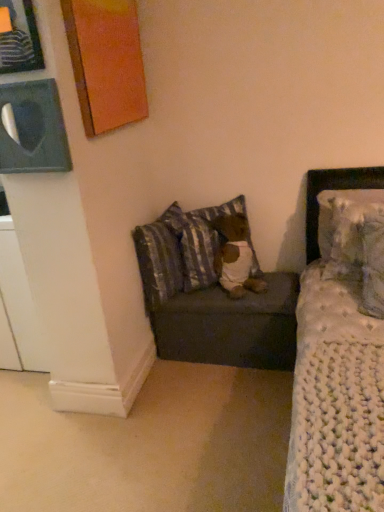
You are a GUI agent. You are given a task and a screenshot of the screen. Output one action in this format:
    pyautogui.click(x=<x>, y=<y>)
    Task: Click on the striped fabric pillow at lower center, the 2th pillow positioned from the left
    The width and height of the screenshot is (384, 512).
    Given the screenshot: What is the action you would take?
    pyautogui.click(x=180, y=251)

Where is `matte black picture frame at upper left, which is the third picture frame from back to front`? The width and height of the screenshot is (384, 512). matte black picture frame at upper left, which is the third picture frame from back to front is located at coordinates (19, 38).

Is striped fabric pillow at lower center, the 2th pillow positioned from the left, further to the viewer compared to dark gray fabric ottoman at center?

Yes, striped fabric pillow at lower center, the 2th pillow positioned from the left, is behind dark gray fabric ottoman at center.

Is striped fabric pillow at lower center, which ranks as the third pillow in right-to-left order, placed right next to dark gray fabric ottoman at center?

striped fabric pillow at lower center, which ranks as the third pillow in right-to-left order, and dark gray fabric ottoman at center are not in contact.

The height and width of the screenshot is (512, 384). I want to click on pillow located behind the dark gray fabric ottoman at center, so click(180, 251).

From the image's perspective, which one is positioned lower, striped fabric pillow at lower center, which ranks as the third pillow in right-to-left order, or dark gray fabric ottoman at center?

dark gray fabric ottoman at center is shown below in the image.

From the image's perspective, relative to white knitted pillow at upper right, placed as the second pillow when sorted from right to left, is white fluffy pillow at upper right, acting as the fourth pillow starting from the left, above or below?

From the image's perspective, white fluffy pillow at upper right, acting as the fourth pillow starting from the left, appears above white knitted pillow at upper right, placed as the second pillow when sorted from right to left.

Can you confirm if white fluffy pillow at upper right, acting as the fourth pillow starting from the left, is wider than white knitted pillow at upper right, placed as the second pillow when sorted from right to left?

In fact, white fluffy pillow at upper right, acting as the fourth pillow starting from the left, might be narrower than white knitted pillow at upper right, placed as the second pillow when sorted from right to left.

Which of these two, striped fabric pillow at lower left, which is counted as the first pillow, starting from the left, or brown plush bear at center, is wider?

With larger width is brown plush bear at center.

Could you tell me if striped fabric pillow at lower left, the fourth pillow from the right, is turned towards brown plush bear at center?

Yes, striped fabric pillow at lower left, the fourth pillow from the right, faces towards brown plush bear at center.

Does point (158, 288) appear closer or farther from the camera than point (243, 236)?

Point (158, 288).

Is striped fabric pillow at lower left, which is counted as the first pillow, starting from the left, not close to matte black picture frame at upper left, which is the first picture frame from back to front?

No, striped fabric pillow at lower left, which is counted as the first pillow, starting from the left, is in close proximity to matte black picture frame at upper left, which is the first picture frame from back to front.

Considering the positions of points (158, 283) and (17, 83), is point (158, 283) closer to camera compared to point (17, 83)?

No.

Which of these two, striped fabric pillow at lower left, the fourth pillow from the right, or matte black picture frame at upper left, which is the first picture frame from back to front, is bigger?

Bigger between the two is striped fabric pillow at lower left, the fourth pillow from the right.

From a real-world perspective, which is physically above, striped fabric pillow at lower left, the fourth pillow from the right, or matte black picture frame at upper left, which is the first picture frame from back to front?

In real-world perspective, matte black picture frame at upper left, which is the first picture frame from back to front, is above.

Which is in front, point (85, 77) or point (154, 275)?

The point (85, 77) is more forward.

Is orange painted wood picture frame at upper left, positioned as the second picture frame in back-to-front order, turned away from striped fabric pillow at lower center, the 2th pillow positioned from the left?

No, orange painted wood picture frame at upper left, positioned as the second picture frame in back-to-front order,'s orientation is not away from striped fabric pillow at lower center, the 2th pillow positioned from the left.

From the image's perspective, which is above, orange painted wood picture frame at upper left, arranged as the second picture frame when viewed from the front, or striped fabric pillow at lower center, which ranks as the third pillow in right-to-left order?

orange painted wood picture frame at upper left, arranged as the second picture frame when viewed from the front, from the image's perspective.

Can you confirm if orange painted wood picture frame at upper left, positioned as the second picture frame in back-to-front order, is shorter than striped fabric pillow at lower center, which ranks as the third pillow in right-to-left order?

No, orange painted wood picture frame at upper left, positioned as the second picture frame in back-to-front order, is not shorter than striped fabric pillow at lower center, which ranks as the third pillow in right-to-left order.

How different are the orientations of dark gray fabric ottoman at center and white fluffy pillow at upper right, acting as the fourth pillow starting from the left, in degrees?

dark gray fabric ottoman at center and white fluffy pillow at upper right, acting as the fourth pillow starting from the left, are facing 0.298 degrees away from each other.

Which is more to the left, dark gray fabric ottoman at center or white fluffy pillow at upper right, which is the 1th pillow from right to left?

dark gray fabric ottoman at center.

Identify the location of pillow that is the 2nd object located in front of the dark gray fabric ottoman at center. The image size is (384, 512). (345, 221).

From the picture: Considering the sizes of striped fabric pillow at lower left, the fourth pillow from the right, and matte black picture frame at upper left, which is the 1th picture frame in front-to-back order, in the image, is striped fabric pillow at lower left, the fourth pillow from the right, taller or shorter than matte black picture frame at upper left, which is the 1th picture frame in front-to-back order,?

In the image, striped fabric pillow at lower left, the fourth pillow from the right, appears to be taller than matte black picture frame at upper left, which is the 1th picture frame in front-to-back order.

What's the angular difference between striped fabric pillow at lower left, which is counted as the first pillow, starting from the left, and matte black picture frame at upper left, which is the third picture frame from back to front,'s facing directions?

79 degrees.

Would you say striped fabric pillow at lower left, which is counted as the first pillow, starting from the left, is a long distance from matte black picture frame at upper left, which is the third picture frame from back to front?

Yes, striped fabric pillow at lower left, which is counted as the first pillow, starting from the left, and matte black picture frame at upper left, which is the third picture frame from back to front, are located far from each other.

I want to click on the 1st pillow to the left of the dark gray fabric ottoman at center, starting your count from the anchor, so [180, 251].

Find the location of a particular element. This screenshot has width=384, height=512. the 3rd pillow positioned below the white fluffy pillow at upper right, acting as the fourth pillow starting from the left (from the image's perspective) is located at coordinates (361, 247).

Which object lies further to the anchor point matte black picture frame at upper left, which is the 1th picture frame in front-to-back order, brown plush bear at center or striped fabric pillow at lower left, the fourth pillow from the right?

Based on the image, brown plush bear at center appears to be further to matte black picture frame at upper left, which is the 1th picture frame in front-to-back order.

Consider the image. Looking at the image, which one is located further to brown plush bear at center, striped fabric pillow at lower left, the fourth pillow from the right, or matte black picture frame at upper left, which is the first picture frame from back to front?

matte black picture frame at upper left, which is the first picture frame from back to front, lies further to brown plush bear at center than the other object.

Considering their positions, is brown plush bear at center positioned further to dark gray fabric ottoman at center than white knitted pillow at upper right, marked as the third pillow in a left-to-right arrangement?

Based on the image, white knitted pillow at upper right, marked as the third pillow in a left-to-right arrangement, appears to be further to dark gray fabric ottoman at center.

Estimate the real-world distances between objects in this image. Which object is closer to striped fabric pillow at lower left, which is counted as the first pillow, starting from the left, matte black picture frame at upper left, placed as the 3th picture frame when sorted from front to back, or orange painted wood picture frame at upper left, positioned as the second picture frame in back-to-front order?

Among the two, matte black picture frame at upper left, placed as the 3th picture frame when sorted from front to back, is located nearer to striped fabric pillow at lower left, which is counted as the first pillow, starting from the left.

In the scene shown: Looking at the image, which one is located closer to striped fabric pillow at lower center, the 2th pillow positioned from the left, white fluffy pillow at upper right, which is the 1th pillow from right to left, or white knitted pillow at upper right, placed as the second pillow when sorted from right to left?

Based on the image, white fluffy pillow at upper right, which is the 1th pillow from right to left, appears to be nearer to striped fabric pillow at lower center, the 2th pillow positioned from the left.

Which object lies further to the anchor point striped fabric pillow at lower center, the 2th pillow positioned from the left, dark gray fabric ottoman at center or white knitted pillow at upper right, marked as the third pillow in a left-to-right arrangement?

white knitted pillow at upper right, marked as the third pillow in a left-to-right arrangement, is further to striped fabric pillow at lower center, the 2th pillow positioned from the left.

Estimate the real-world distances between objects in this image. Which object is closer to brown plush bear at center, orange painted wood picture frame at upper left, arranged as the second picture frame when viewed from the front, or matte black picture frame at upper left, which is the third picture frame from back to front?

Among the two, orange painted wood picture frame at upper left, arranged as the second picture frame when viewed from the front, is located nearer to brown plush bear at center.

Which object lies nearer to the anchor point white knitted pillow at upper right, placed as the second pillow when sorted from right to left, orange painted wood picture frame at upper left, positioned as the second picture frame in back-to-front order, or white fluffy pillow at upper right, acting as the fourth pillow starting from the left?

white fluffy pillow at upper right, acting as the fourth pillow starting from the left, is closer to white knitted pillow at upper right, placed as the second pillow when sorted from right to left.

Locate an element on the screen. picture frame between matte black picture frame at upper left, which is the first picture frame from back to front, and brown plush bear at center is located at coordinates (106, 62).

Where is `picture frame that lies between orange painted wood picture frame at upper left, positioned as the second picture frame in back-to-front order, and matte black picture frame at upper left, which is the first picture frame from back to front, from top to bottom`? The height and width of the screenshot is (512, 384). picture frame that lies between orange painted wood picture frame at upper left, positioned as the second picture frame in back-to-front order, and matte black picture frame at upper left, which is the first picture frame from back to front, from top to bottom is located at coordinates (19, 38).

Locate an element on the screen. The width and height of the screenshot is (384, 512). table between striped fabric pillow at lower center, the 2th pillow positioned from the left, and white fluffy pillow at upper right, which is the 1th pillow from right to left is located at coordinates (231, 326).

Where is `animal between striped fabric pillow at lower left, the fourth pillow from the right, and white fluffy pillow at upper right, acting as the fourth pillow starting from the left`? animal between striped fabric pillow at lower left, the fourth pillow from the right, and white fluffy pillow at upper right, acting as the fourth pillow starting from the left is located at coordinates (235, 256).